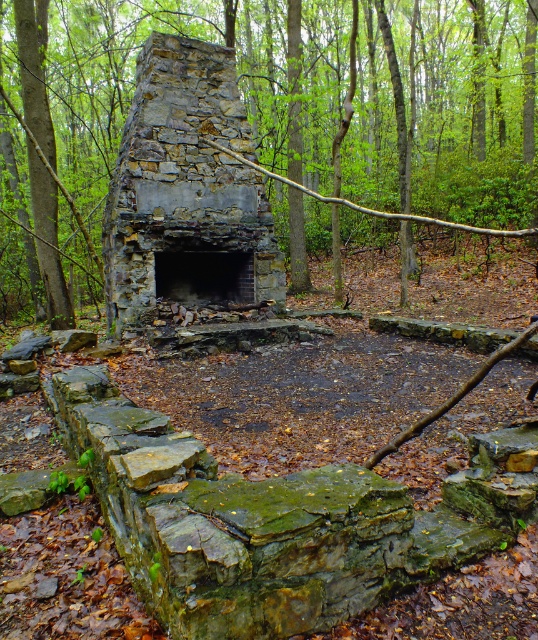
Question: Is green mossy stone chimney at center bigger than dark gray stone fireplace at center?

Choices:
 (A) yes
 (B) no

Answer: (A)

Question: Considering the real-world distances, which object is farthest from the dark gray stone fireplace at center?

Choices:
 (A) green mossy stone chimney at center
 (B) rustic stone fireplace at center

Answer: (A)

Question: Which point appears farthest from the camera in this image?

Choices:
 (A) (240, 291)
 (B) (258, 112)

Answer: (B)

Question: Can you confirm if green mossy stone chimney at center is positioned to the left of dark gray stone fireplace at center?

Choices:
 (A) yes
 (B) no

Answer: (B)

Question: Which point appears farthest from the camera in this image?

Choices:
 (A) (196, 266)
 (B) (424, 152)
 (C) (145, 99)

Answer: (B)

Question: Does green mossy stone chimney at center have a lesser width compared to rustic stone fireplace at center?

Choices:
 (A) no
 (B) yes

Answer: (A)